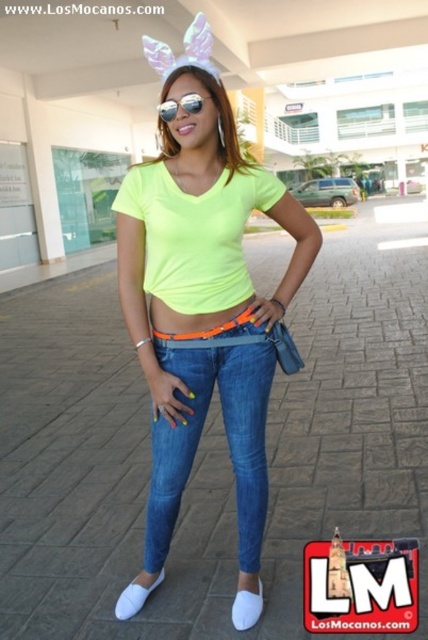
Can you confirm if neon yellow fabric top at center is thinner than sunglasses at center?

No, neon yellow fabric top at center is not thinner than sunglasses at center.

Is point (246, 196) less distant than point (196, 108)?

That is False.

Where is `neon yellow fabric top at center`? neon yellow fabric top at center is located at coordinates (204, 298).

Find the location of a particular element. The height and width of the screenshot is (640, 428). neon yellow fabric top at center is located at coordinates (204, 298).

Can you confirm if white fabric shoe at lower center is positioned below sunglasses at center?

Indeed, white fabric shoe at lower center is positioned under sunglasses at center.

Is white fabric shoe at lower center thinner than sunglasses at center?

Indeed, white fabric shoe at lower center has a lesser width compared to sunglasses at center.

Where is `white fabric shoe at lower center`? white fabric shoe at lower center is located at coordinates (246, 608).

Is neon yellow fabric top at center above denim jeans at center?

Yes, neon yellow fabric top at center is above denim jeans at center.

Is neon yellow fabric top at center thinner than denim jeans at center?

No, neon yellow fabric top at center is not thinner than denim jeans at center.

Image resolution: width=428 pixels, height=640 pixels. What do you see at coordinates (204, 298) in the screenshot? I see `neon yellow fabric top at center` at bounding box center [204, 298].

Locate an element on the screen. The width and height of the screenshot is (428, 640). neon yellow fabric top at center is located at coordinates (204, 298).